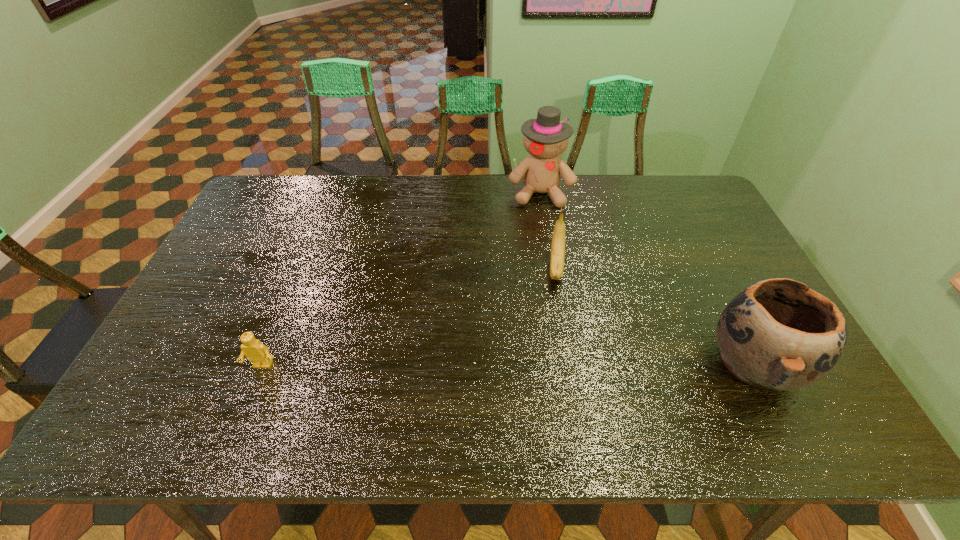
Identify the location of the shortest object. (256, 352).

Identify the location of Lego. This screenshot has height=540, width=960. (256, 352).

This screenshot has height=540, width=960. What are the coordinates of `the third shortest object` in the screenshot? It's located at (779, 334).

Where is `pottery`? The height and width of the screenshot is (540, 960). pottery is located at coordinates (779, 334).

Where is `the second shortest object`? This screenshot has width=960, height=540. the second shortest object is located at coordinates (558, 238).

This screenshot has width=960, height=540. What are the coordinates of `the second farthest object` in the screenshot? It's located at (558, 238).

Where is `the tallest object`? The height and width of the screenshot is (540, 960). the tallest object is located at coordinates (545, 138).

Locate an element on the screen. The image size is (960, 540). rag_doll is located at coordinates (545, 138).

Identify the location of blank area located on the back of the third shortest object. The width and height of the screenshot is (960, 540). (694, 242).

At what (x,y) coordinates should I click in order to perform the action: click on vacant space located 0.330m at the start of the peel on the second shortest object. Please return your answer as a coordinate pair (x, y). Looking at the image, I should click on (556, 393).